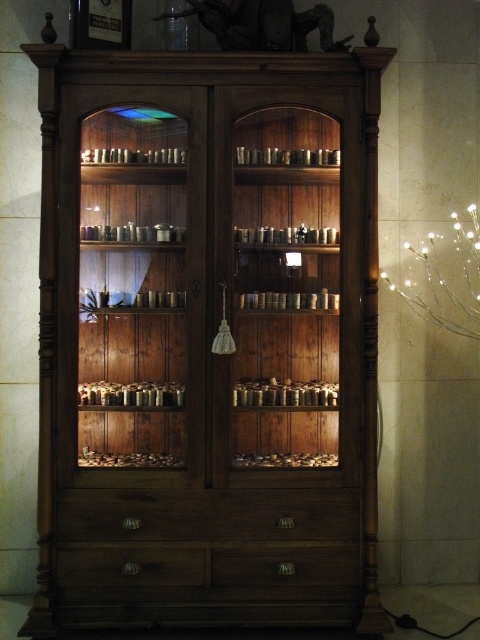
You are organizing items in the cabinet and need to place both the matte wood drawer at center and the transparent glass jar at upper center. Which object requires more space for placement?

The transparent glass jar at upper center requires more space for placement since the matte wood drawer at center occupies less space than it.

You are organizing items in the cabinet and need to place a small decorative item. Which object, the matte wood drawer at lower center or the transparent glass jar at upper center, can fit the item if it requires a smaller space?

The matte wood drawer at lower center has a smaller size compared to the transparent glass jar at upper center, so it can fit the small decorative item.

You are organizing items in the cabinet and need to place a small decorative item. The item is too fragile to place below other objects. Can you place it on the matte wood drawer at lower center without it being under the transparent glass jar at upper center?

The matte wood drawer at lower center is below the transparent glass jar at upper center, so placing the item on the matte wood drawer at lower center would mean it is under the transparent glass jar at upper center. Therefore, you cannot place it there without it being under the jar.